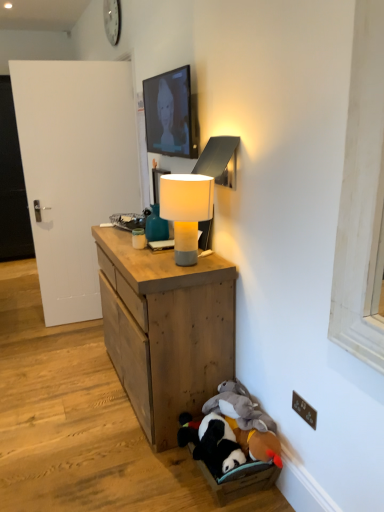
What is the approximate height of brown plastic electric outlet at lower right?

3.79 inches.

What do you see at coordinates (231, 430) in the screenshot? I see `soft plush toys at lower right` at bounding box center [231, 430].

Find the location of a particular element. Image resolution: width=384 pixels, height=512 pixels. soft plush toys at lower right is located at coordinates (231, 430).

Locate an element on the screen. The width and height of the screenshot is (384, 512). white matte lamp at center is located at coordinates (186, 210).

Locate an element on the screen. The height and width of the screenshot is (512, 384). white matte door at left, which ranks as the 2th door in front-to-back order is located at coordinates (12, 184).

Where is `white matte door at left, the second door in the back-to-front sequence`? This screenshot has height=512, width=384. white matte door at left, the second door in the back-to-front sequence is located at coordinates (74, 170).

Is soft plush toys at lower right in front of or behind white matte door at left, which ranks as the 2th door in front-to-back order, in the image?

Visually, soft plush toys at lower right is located in front of white matte door at left, which ranks as the 2th door in front-to-back order.

Between soft plush toys at lower right and white matte door at left, which ranks as the 2th door in front-to-back order, which one has smaller size?

soft plush toys at lower right is smaller.

Based on their positions, is soft plush toys at lower right located to the left or right of white matte door at left, which ranks as the 2th door in front-to-back order?

From the image, it's evident that soft plush toys at lower right is to the right of white matte door at left, which ranks as the 2th door in front-to-back order.

From their relative heights in the image, would you say soft plush toys at lower right is taller or shorter than white matte door at left, positioned as the 1th door in left-to-right order?

In the image, soft plush toys at lower right appears to be shorter than white matte door at left, positioned as the 1th door in left-to-right order.

Between point (15, 118) and point (238, 392), which one is positioned in front?

The point (238, 392) is in front.

Consider the image. Which of these two, white matte door at left, positioned as the 1th door in left-to-right order, or soft plush toys at lower right, is thinner?

soft plush toys at lower right is thinner.

Is white matte door at left, the first door positioned from the back, further to the viewer compared to soft plush toys at lower right?

Yes, white matte door at left, the first door positioned from the back, is further from the viewer.

Is soft plush toys at lower right inside white matte door at left, positioned as the 1th door in left-to-right order?

That's incorrect, soft plush toys at lower right is not inside white matte door at left, positioned as the 1th door in left-to-right order.

Considering the positions of objects white matte lamp at center and soft plush toys at lower right in the image provided, who is more to the right, white matte lamp at center or soft plush toys at lower right?

From the viewer's perspective, soft plush toys at lower right appears more on the right side.

From a real-world perspective, who is located lower, white matte lamp at center or soft plush toys at lower right?

soft plush toys at lower right, from a real-world perspective.

Based on the photo, from the image's perspective, which one is positioned higher, white matte lamp at center or soft plush toys at lower right?

white matte lamp at center.

Is white matte lamp at center thinner than soft plush toys at lower right?

In fact, white matte lamp at center might be wider than soft plush toys at lower right.

How much distance is there between white matte door at left, the second door in the left-to-right sequence, and brown plastic electric outlet at lower right?

white matte door at left, the second door in the left-to-right sequence, is 7.63 feet from brown plastic electric outlet at lower right.

You are a GUI agent. You are given a task and a screenshot of the screen. Output one action in this format:
    pyautogui.click(x=<x>, y=<y>)
    Task: Click on the electric outlet that appears below the white matte door at left, the 1th door from the right (from a real-world perspective)
    
    Given the screenshot: What is the action you would take?
    pyautogui.click(x=304, y=410)

Is point (82, 170) more distant than point (303, 409)?

Yes, it is behind point (303, 409).

Are white matte door at left, the second door in the back-to-front sequence, and brown plastic electric outlet at lower right located far from each other?

Yes.

Between point (180, 227) and point (304, 409), which one is positioned in front?

The point (304, 409) is closer to the camera.

Is brown plastic electric outlet at lower right at the back of white matte lamp at center?

white matte lamp at center does not have its back to brown plastic electric outlet at lower right.

Considering the relative sizes of white matte lamp at center and brown plastic electric outlet at lower right in the image provided, is white matte lamp at center wider than brown plastic electric outlet at lower right?

Indeed, white matte lamp at center has a greater width compared to brown plastic electric outlet at lower right.

Is white matte lamp at center at the left side of brown plastic electric outlet at lower right?

Indeed, white matte lamp at center is positioned on the left side of brown plastic electric outlet at lower right.

Considering the sizes of objects soft plush toys at lower right and white matte lamp at center in the image provided, who is smaller, soft plush toys at lower right or white matte lamp at center?

soft plush toys at lower right.

Which of these two, soft plush toys at lower right or white matte lamp at center, stands shorter?

With less height is soft plush toys at lower right.

Does soft plush toys at lower right turn towards white matte lamp at center?

No, soft plush toys at lower right does not turn towards white matte lamp at center.

Is soft plush toys at lower right beside white matte lamp at center?

No, soft plush toys at lower right is not beside white matte lamp at center.

Consider the image. Who is shorter, wooden cabinet at center or soft plush toys at lower right?

soft plush toys at lower right is shorter.

From the image's perspective, between wooden cabinet at center and soft plush toys at lower right, who is located below?

soft plush toys at lower right, from the image's perspective.

Considering the relative positions of wooden cabinet at center and soft plush toys at lower right in the image provided, is wooden cabinet at center behind soft plush toys at lower right?

Yes, wooden cabinet at center is behind soft plush toys at lower right.

From the image's perspective, starting from the soft plush toys at lower right, which door is the 2nd one above? Please provide its 2D coordinates.

[(12, 184)]

You are a GUI agent. You are given a task and a screenshot of the screen. Output one action in this format:
    pyautogui.click(x=<x>, y=<y>)
    Task: Click on the stuff lying on the right of white matte door at left, the first door positioned from the back
    
    Given the screenshot: What is the action you would take?
    pyautogui.click(x=231, y=430)

Considering their positions, is white plastic clock at upper center positioned further to wooden cabinet at center than soft plush toys at lower right?

white plastic clock at upper center lies further to wooden cabinet at center than the other object.

When comparing their distances from wooden cabinet at center, does white matte door at left, positioned as the 1th door in left-to-right order, or matte black tv at upper center seem further?

white matte door at left, positioned as the 1th door in left-to-right order.

Estimate the real-world distances between objects in this image. Which object is closer to white matte door at left, which ranks as the 2th door in front-to-back order, white matte door at left, the second door in the left-to-right sequence, or white plastic clock at upper center?

white matte door at left, the second door in the left-to-right sequence, is positioned closer to the anchor white matte door at left, which ranks as the 2th door in front-to-back order.

Based on their spatial positions, is soft plush toys at lower right or white matte door at left, the first door positioned from the back, further from white plastic clock at upper center?

soft plush toys at lower right.

Looking at the image, which one is located closer to white matte lamp at center, brown plastic electric outlet at lower right or soft plush toys at lower right?

soft plush toys at lower right lies closer to white matte lamp at center than the other object.

From the image, which object appears to be farther from wooden cabinet at center, matte black tv at upper center or soft plush toys at lower right?

Among the two, matte black tv at upper center is located further to wooden cabinet at center.

Estimate the real-world distances between objects in this image. Which object is closer to brown plastic electric outlet at lower right, wooden cabinet at center or white matte door at left, acting as the 2th door starting from the right?

Based on the image, wooden cabinet at center appears to be nearer to brown plastic electric outlet at lower right.

Based on their spatial positions, is matte black tv at upper center or white matte door at left, the second door in the back-to-front sequence, closer to white matte door at left, positioned as the 1th door in left-to-right order?

Among the two, white matte door at left, the second door in the back-to-front sequence, is located nearer to white matte door at left, positioned as the 1th door in left-to-right order.

At what (x,y) coordinates should I click in order to perform the action: click on door between wooden cabinet at center and white matte door at left, the first door positioned from the back, in the front-back direction. Please return your answer as a coordinate pair (x, y). The width and height of the screenshot is (384, 512). Looking at the image, I should click on (74, 170).

Where is `door between matte black tv at upper center and soft plush toys at lower right in the up-down direction`? This screenshot has width=384, height=512. door between matte black tv at upper center and soft plush toys at lower right in the up-down direction is located at coordinates (74, 170).

Image resolution: width=384 pixels, height=512 pixels. In order to click on cabinetry positioned between soft plush toys at lower right and white matte door at left, acting as the 2th door starting from the right, from near to far in this screenshot , I will do `click(165, 329)`.

What are the coordinates of `picture frame between white plastic clock at upper center and soft plush toys at lower right in the up-down direction` in the screenshot? It's located at (171, 114).